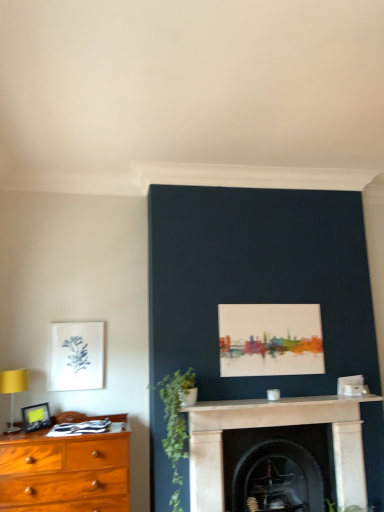
Question: From the image's perspective, is green matte plant at center-left positioned above or below dark stone fireplace at center, placed as the second fireplace when sorted from front to back?

Choices:
 (A) above
 (B) below

Answer: (A)

Question: Does point (175, 482) appear closer or farther from the camera than point (312, 435)?

Choices:
 (A) farther
 (B) closer

Answer: (B)

Question: Which of these objects is positioned farthest from the dark stone fireplace at center, placed as the second fireplace when sorted from front to back?

Choices:
 (A) white marble fireplace at center, which appears as the 2th fireplace when viewed from the back
 (B) white marble mantle at center
 (C) green matte plant at center-left
 (D) matte white picture frame at left, acting as the 1th picture frame starting from the back
 (E) matte black picture frame at left, which is the 1th picture frame from bottom to top

Answer: (E)

Question: Which object is the closest to the white marble fireplace at center, which appears as the 2th fireplace when viewed from the back?

Choices:
 (A) green matte plant at center-left
 (B) white marble mantle at center
 (C) yellow fabric lampshade at left
 (D) dark stone fireplace at center, which ranks as the first fireplace in back-to-front order
 (E) matte white picture frame at left, acting as the 1th picture frame starting from the back

Answer: (D)